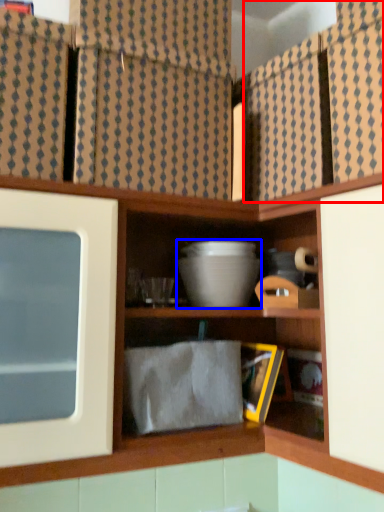
Question: Which of the following is the closest to the observer, cabinet (highlighted by a red box) or mixing bowl (highlighted by a blue box)?

Choices:
 (A) cabinet
 (B) mixing bowl

Answer: (A)